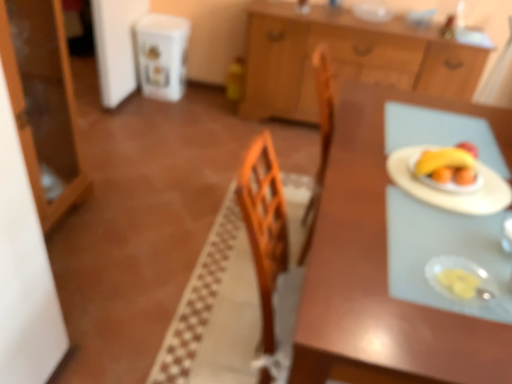
Question: Is translucent plastic plate at right, which ranks as the 1th tableware in front-to-back order, smaller than white paper plate at right?

Choices:
 (A) no
 (B) yes

Answer: (B)

Question: Is translucent plastic plate at right, which ranks as the 1th tableware in front-to-back order, outside white paper plate at right?

Choices:
 (A) no
 (B) yes

Answer: (B)

Question: From a real-world perspective, is translucent plastic plate at right, the first tableware when ordered from left to right, below white paper plate at right?

Choices:
 (A) no
 (B) yes

Answer: (A)

Question: Can you confirm if translucent plastic plate at right, the first tableware when ordered from left to right, is positioned to the right of white paper plate at right?

Choices:
 (A) yes
 (B) no

Answer: (B)

Question: Considering the relative sizes of translucent plastic plate at right, which ranks as the 1th tableware in front-to-back order, and white paper plate at right in the image provided, is translucent plastic plate at right, which ranks as the 1th tableware in front-to-back order, taller than white paper plate at right?

Choices:
 (A) yes
 (B) no

Answer: (A)

Question: Can white paper plate at right be found inside translucent plastic plate at right, the first tableware when ordered from left to right?

Choices:
 (A) yes
 (B) no

Answer: (B)

Question: Is wooden table at center positioned with its back to matte wood cabinet at left, which is the 1th cabinetry in left-to-right order?

Choices:
 (A) yes
 (B) no

Answer: (B)

Question: Is wooden table at center smaller than matte wood cabinet at left, the 1th cabinetry in the front-to-back sequence?

Choices:
 (A) yes
 (B) no

Answer: (B)

Question: Could you tell me if wooden table at center is turned towards matte wood cabinet at left, the 2th cabinetry positioned from the back?

Choices:
 (A) yes
 (B) no

Answer: (A)

Question: Is wooden table at center far from matte wood cabinet at left, which is the 1th cabinetry in left-to-right order?

Choices:
 (A) yes
 (B) no

Answer: (A)

Question: Does wooden table at center appear on the left side of matte wood cabinet at left, the 2th cabinetry positioned from the back?

Choices:
 (A) yes
 (B) no

Answer: (B)

Question: Is wooden table at center shorter than matte wood cabinet at left, which is the 1th cabinetry in left-to-right order?

Choices:
 (A) no
 (B) yes

Answer: (B)

Question: Would you consider wooden cabinet at upper center, arranged as the 2th cabinetry when viewed from the left, to be distant from wooden table at center?

Choices:
 (A) no
 (B) yes

Answer: (B)